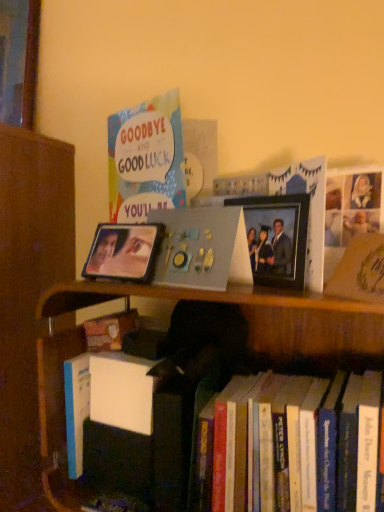
Question: In the image, is matte paper card at upper left positioned in front of or behind hardcover books at lower right?

Choices:
 (A) front
 (B) behind

Answer: (B)

Question: Does point (127, 153) appear closer or farther from the camera than point (54, 337)?

Choices:
 (A) farther
 (B) closer

Answer: (A)

Question: Based on their relative distances, which object is farther from the metallic photo frame at center, which is the second picture frame in left-to-right order?

Choices:
 (A) matte paper card at upper left
 (B) hardcover books at lower right
 (C) metallic reflective photo frame at center, the 2th picture frame viewed from the right
 (D) matte gray photo album at center

Answer: (A)

Question: Which of these objects is positioned farthest from the metallic reflective photo frame at center, the 1th picture frame positioned from the left?

Choices:
 (A) matte gray photo album at center
 (B) matte paper card at upper left
 (C) metallic photo frame at center, the first picture frame positioned from the right
 (D) hardcover books at lower right

Answer: (C)